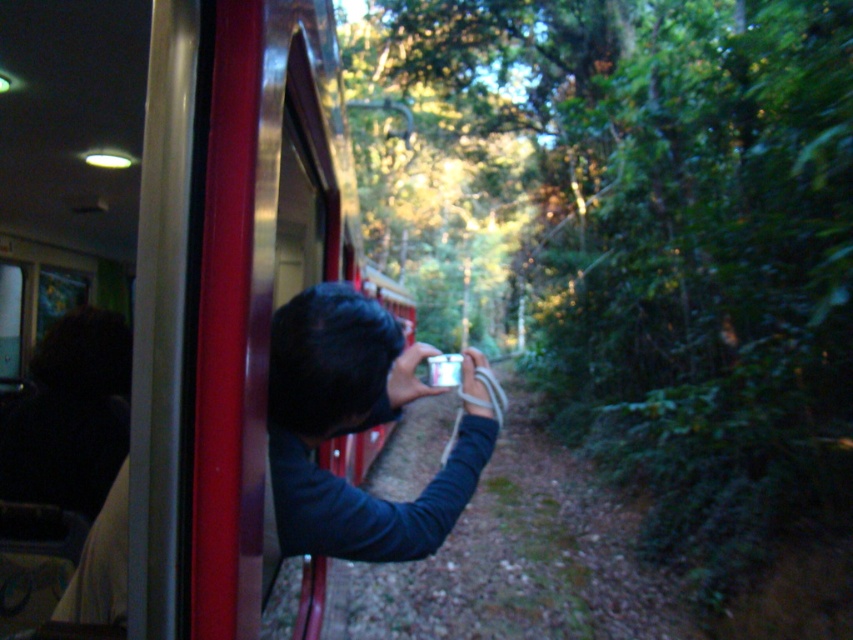
You are a passenger on the train and want to take a photo of the metallic red train at left using the metallic silver camera at center. Can you do this without moving the camera from its current position?

The metallic red train at left is above the metallic silver camera at center, so you can take the photo by pointing the camera upwards towards the train.

You are a passenger on the train and want to take a photo of the forest outside. You have a metallic silver camera at center. Can you use it to take the photo while standing near the metallic red train at left?

The metallic silver camera at center is behind the metallic red train at left, so it is obstructed and cannot be used to take a photo of the forest outside while standing near the metallic red train at left.